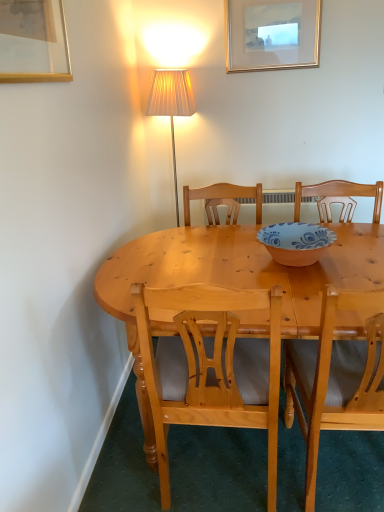
Question: Is light wood chair at center, which is the first chair from right to left, oriented towards gold-framed picture at upper left, which is the 1th picture frame from left to right?

Choices:
 (A) yes
 (B) no

Answer: (B)

Question: Could gold-framed picture at upper left, the 1th picture frame ordered from the bottom, be considered to be inside light wood chair at center, positioned as the 2th chair in left-to-right order?

Choices:
 (A) yes
 (B) no

Answer: (B)

Question: Is light wood chair at center, which is the first chair from right to left, far away from gold-framed picture at upper left, the 2th picture frame from the back?

Choices:
 (A) yes
 (B) no

Answer: (A)

Question: Are light wood chair at center, positioned as the 2th chair in left-to-right order, and gold-framed picture at upper left, acting as the 2th picture frame starting from the right, making contact?

Choices:
 (A) no
 (B) yes

Answer: (A)

Question: Can you confirm if light wood chair at center, positioned as the 2th chair in left-to-right order, is thinner than gold-framed picture at upper left, the 1th picture frame from the front?

Choices:
 (A) yes
 (B) no

Answer: (B)

Question: Is light wood chair at center, positioned as the 2th chair in left-to-right order, to the left or to the right of light wood chair at center, acting as the first chair starting from the left, in the image?

Choices:
 (A) right
 (B) left

Answer: (A)

Question: Is light wood chair at center, which is the first chair from right to left, bigger or smaller than light wood chair at center, which is the 2th chair in right-to-left order?

Choices:
 (A) small
 (B) big

Answer: (A)

Question: In terms of height, does light wood chair at center, positioned as the 2th chair in left-to-right order, look taller or shorter compared to light wood chair at center, acting as the first chair starting from the left?

Choices:
 (A) short
 (B) tall

Answer: (B)

Question: Relative to light wood chair at center, acting as the first chair starting from the left, is light wood chair at center, positioned as the 2th chair in left-to-right order, in front or behind?

Choices:
 (A) front
 (B) behind

Answer: (A)

Question: Do you think gold metallic picture frame at upper center, the first picture frame viewed from the top, is within gold-framed picture at upper left, the 2th picture frame from the back, or outside of it?

Choices:
 (A) inside
 (B) outside

Answer: (B)

Question: From a real-world perspective, is gold metallic picture frame at upper center, which appears as the second picture frame when ordered from the bottom, positioned above or below gold-framed picture at upper left, the 2th picture frame from the back?

Choices:
 (A) below
 (B) above

Answer: (B)

Question: From their relative heights in the image, would you say gold metallic picture frame at upper center, which appears as the second picture frame when ordered from the bottom, is taller or shorter than gold-framed picture at upper left, acting as the 2th picture frame starting from the right?

Choices:
 (A) short
 (B) tall

Answer: (B)

Question: Visually, is gold metallic picture frame at upper center, marked as the second picture frame in a left-to-right arrangement, positioned to the left or to the right of gold-framed picture at upper left, acting as the 2th picture frame starting from the right?

Choices:
 (A) left
 (B) right

Answer: (B)

Question: Considering the positions of light wood chair at center, which is the 2th chair in right-to-left order, and gold metallic picture frame at upper center, the first picture frame viewed from the top, in the image, is light wood chair at center, which is the 2th chair in right-to-left order, taller or shorter than gold metallic picture frame at upper center, the first picture frame viewed from the top,?

Choices:
 (A) short
 (B) tall

Answer: (B)

Question: Visually, is light wood chair at center, which is the 2th chair in right-to-left order, positioned to the left or to the right of gold metallic picture frame at upper center, marked as the first picture frame in a back-to-front arrangement?

Choices:
 (A) left
 (B) right

Answer: (A)